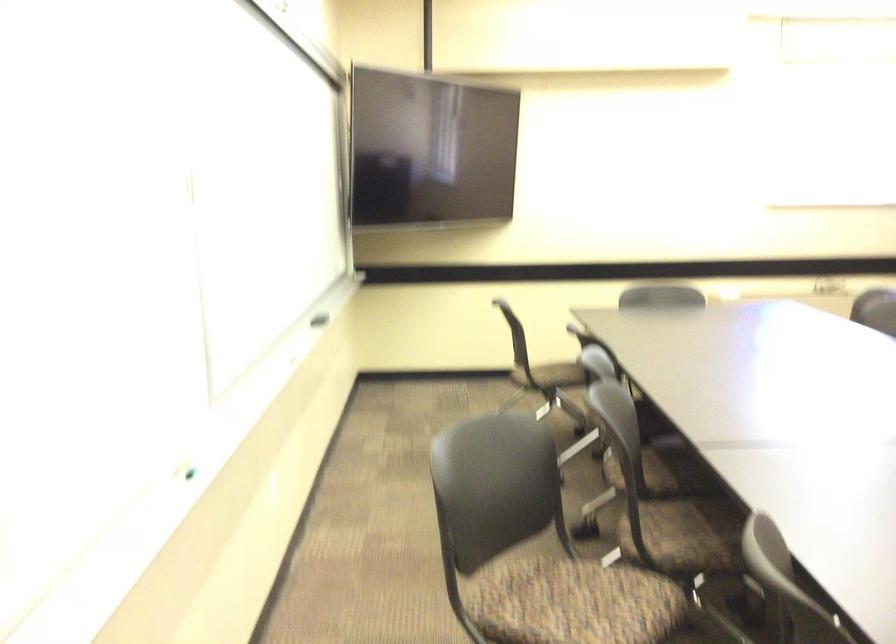
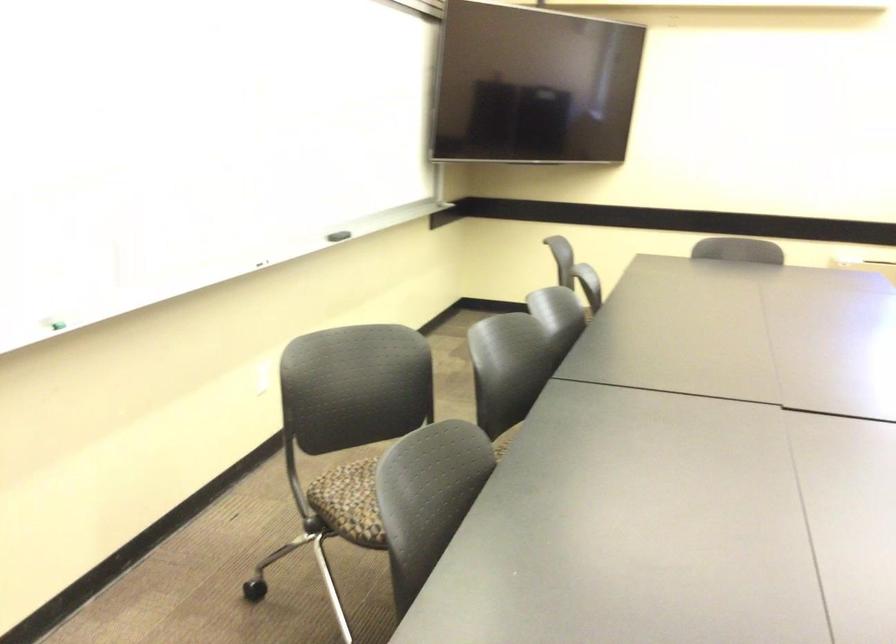
Locate, in the second image, the point that corresponds to point 174,471 in the first image.

(55, 325)